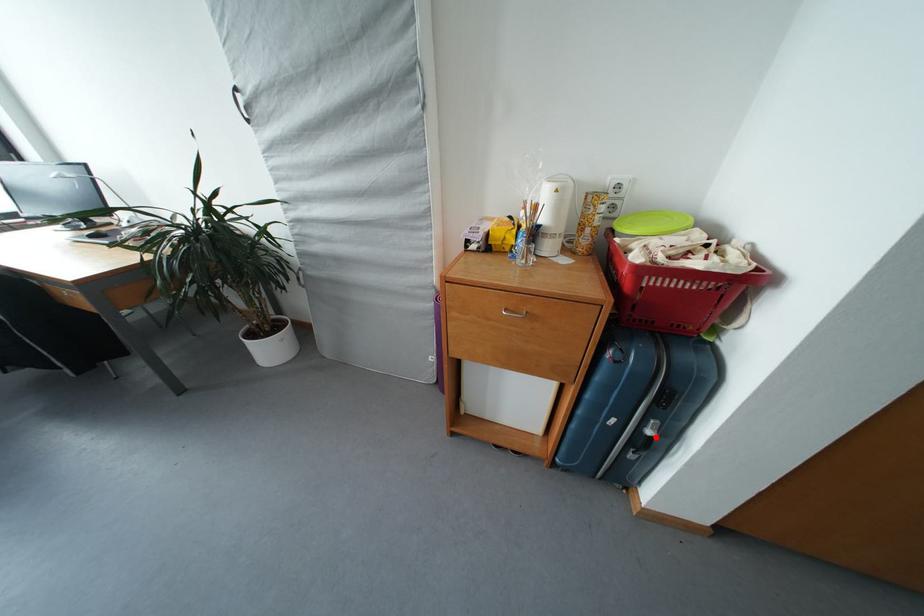
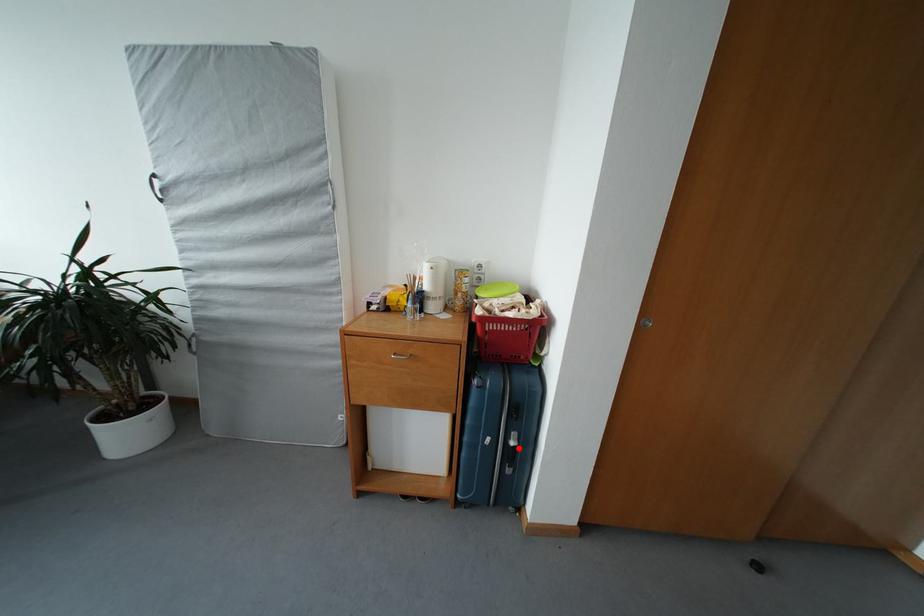
I am providing you with two images of the same scene from different viewpoints. A red point is marked on the first image and another point is marked on the second image. Is the red point in image1 aligned with the point shown in image2?

Yes